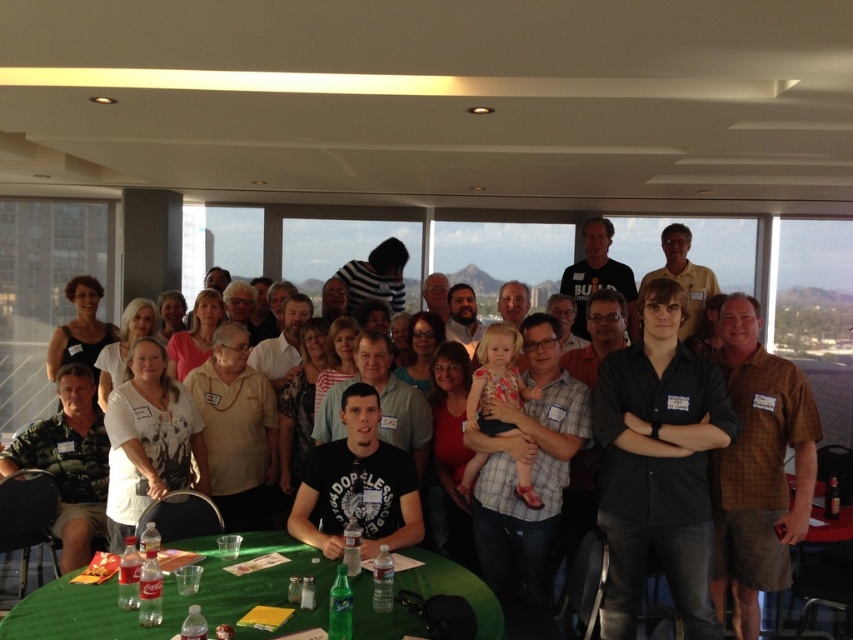
You are organizing a photo shoot and need to ensure that the black matte shirt at center and the brown plaid shirt at right are visible in the frame. Given that the camera has a fixed focal length, which shirt should you focus on to ensure both are in focus?

The black matte shirt at center is smaller than the brown plaid shirt at right. Since the black matte shirt at center is smaller, it is likely farther away from the camera compared to the brown plaid shirt at right. To ensure both are in focus, focus on the shirt that is farther away, which is the black matte shirt at center, as depth of field extends more behind the point of focus than in front.

Where is the black matte shirt at center located in the image?

The black matte shirt at center is located at point (659,465).

You are a photographer taking a picture of the group at the event. You notice a point at coordinate (659,465). What object is this point located on?

The point at coordinate (659,465) is located on the black matte shirt at center.